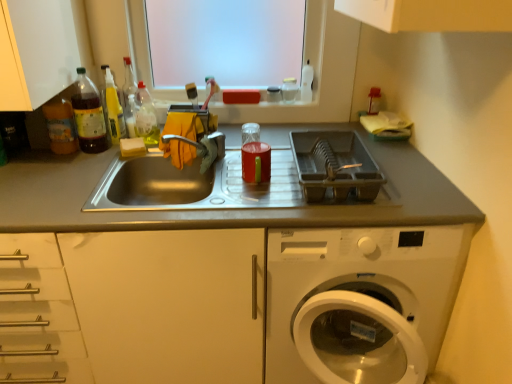
Image resolution: width=512 pixels, height=384 pixels. What are the coordinates of `vacant space in front of translucent plastic bottle at left, the 1th bottle viewed from the left` in the screenshot? It's located at [45, 165].